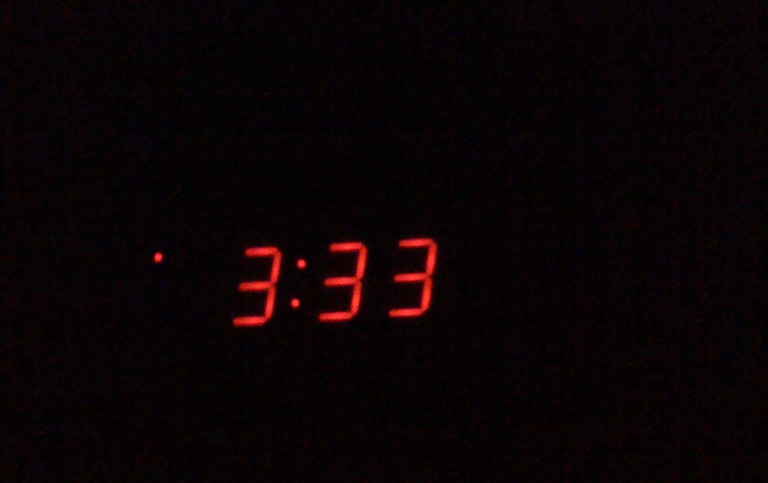
Identify the location of clock. The image size is (768, 483). (313, 300).